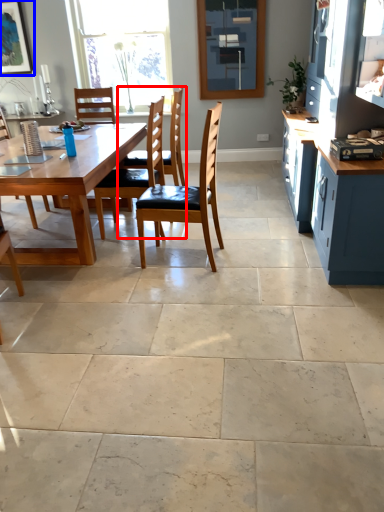
Question: Which object is further to the camera taking this photo, chair (highlighted by a red box) or picture frame (highlighted by a blue box)?

Choices:
 (A) chair
 (B) picture frame

Answer: (B)